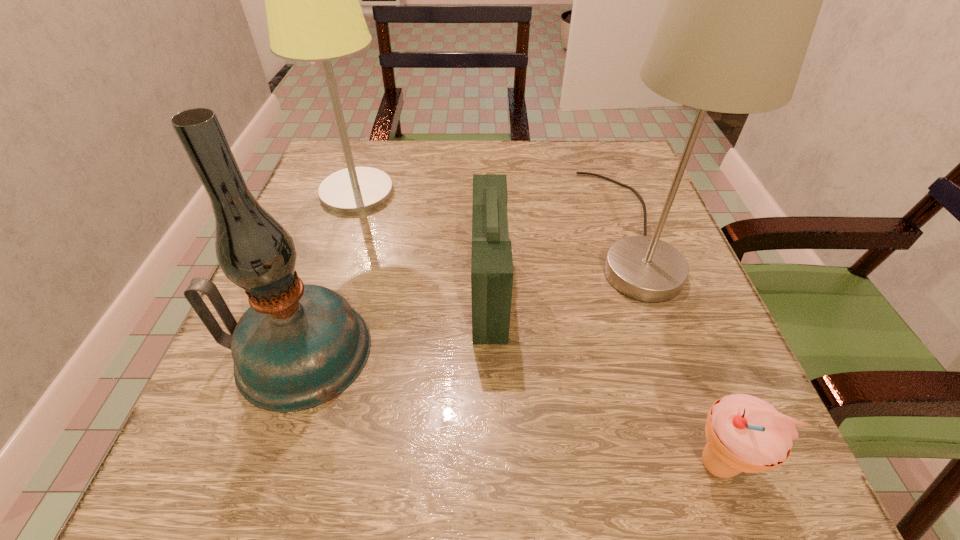
This screenshot has height=540, width=960. I want to click on the right table lamp, so click(x=744, y=0).

This screenshot has height=540, width=960. I want to click on the left table lamp, so click(x=313, y=14).

Find the location of a particular element. Image resolution: width=960 pixels, height=540 pixels. the third shortest object is located at coordinates (297, 346).

Locate an element on the screen. This screenshot has width=960, height=540. the first-aid kit is located at coordinates click(x=491, y=256).

What are the coordinates of `icecream` in the screenshot? It's located at (744, 433).

The height and width of the screenshot is (540, 960). Find the location of `the shortest object`. the shortest object is located at coordinates (744, 433).

Where is `vacant space situated on the front of the right table lamp`? vacant space situated on the front of the right table lamp is located at coordinates (692, 410).

Where is `blank area located 0.230m on the right of the left table lamp`? The width and height of the screenshot is (960, 540). blank area located 0.230m on the right of the left table lamp is located at coordinates (497, 192).

This screenshot has height=540, width=960. Identify the location of vacant space located 0.220m on the back of the third shortest object. (344, 222).

Locate an element on the screen. vacant space positioned 0.190m on the front-facing side of the first-aid kit is located at coordinates (367, 290).